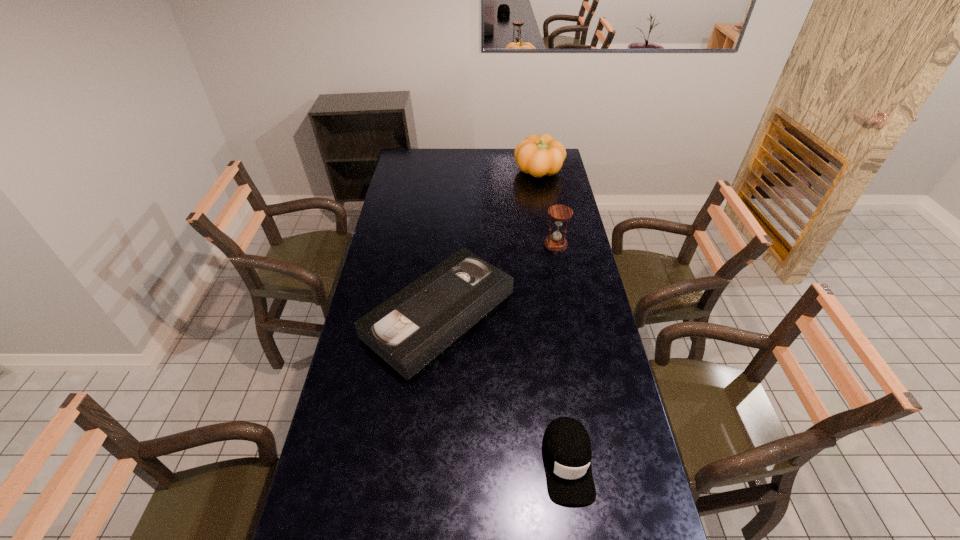
The image size is (960, 540). Identify the location of vacant space positioned 0.060m on the front of the shortest object. (432, 397).

This screenshot has height=540, width=960. Identify the location of object that is at the far edge. (541, 155).

This screenshot has width=960, height=540. I want to click on object at the left edge, so click(411, 328).

Locate an element on the screen. The height and width of the screenshot is (540, 960). pumpkin located at the right edge is located at coordinates (541, 155).

This screenshot has width=960, height=540. In order to click on hourglass that is at the right edge in this screenshot , I will do `click(556, 242)`.

The image size is (960, 540). In order to click on cap located at the right edge in this screenshot , I will do `click(566, 446)`.

Identify the location of object positioned at the far right corner. (541, 155).

Find the location of `free space at the far edge`. free space at the far edge is located at coordinates (499, 156).

The image size is (960, 540). I want to click on vacant space at the left edge of the desktop, so click(415, 172).

Identify the location of vacant area at the right edge. The width and height of the screenshot is (960, 540). (540, 202).